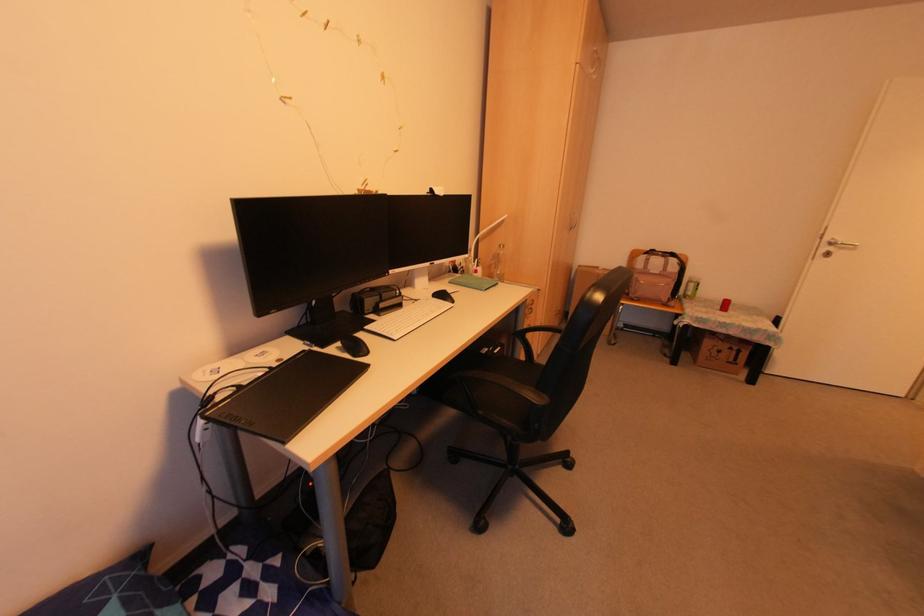
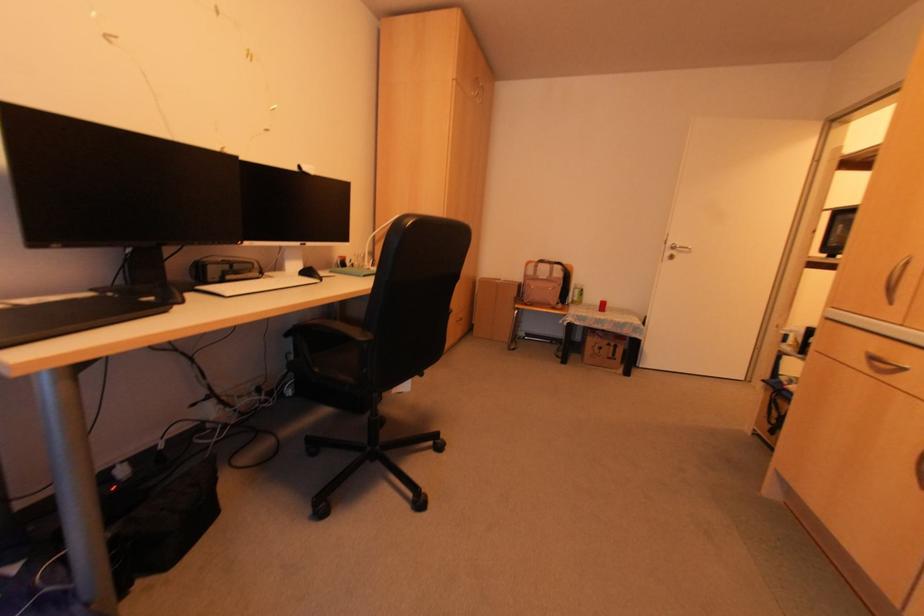
In the second image, find the point that corresponds to point 440,296 in the first image.

(305, 274)